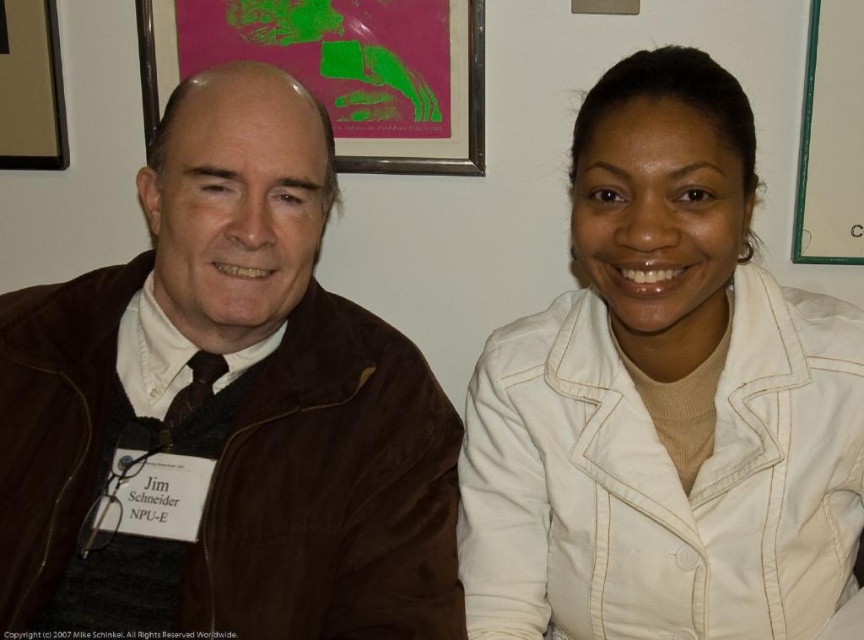
Between white matte jacket at upper right and brown wooden picture frame at upper left, which one appears on the right side from the viewer's perspective?

From the viewer's perspective, white matte jacket at upper right appears more on the right side.

What are the coordinates of `white matte jacket at upper right` in the screenshot? It's located at (664, 400).

Which is below, brown suede jacket at left or brown wooden picture frame at upper left?

brown suede jacket at left is lower down.

Does brown suede jacket at left have a greater width compared to brown wooden picture frame at upper left?

Correct, the width of brown suede jacket at left exceeds that of brown wooden picture frame at upper left.

Locate an element on the screen. brown suede jacket at left is located at coordinates (x=224, y=410).

Is brown suede jacket at left shorter than pink paper at upper center?

In fact, brown suede jacket at left may be taller than pink paper at upper center.

Is brown suede jacket at left taller than pink paper at upper center?

Yes.

Between point (242, 131) and point (454, 150), which one is positioned in front?

Point (242, 131) is in front.

In order to click on brown suede jacket at left in this screenshot , I will do `click(224, 410)`.